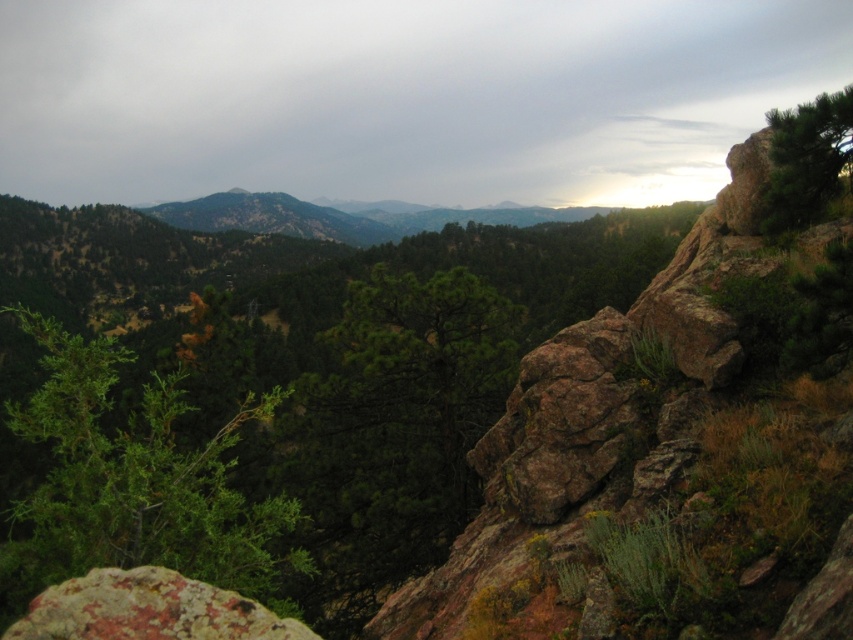
You are an environmental scientist studying the mountain ecosystem. You observe the green leafy tree at center and the green textured pine tree at upper right. Which tree is closer to you based on their positions in the landscape?

The green leafy tree at center is closer to you because it is positioned in front of the green textured pine tree at upper right.